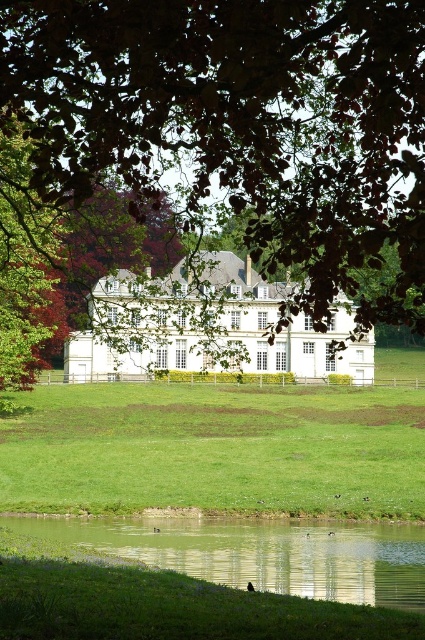
Does green leafy tree at center have a lesser width compared to green grassy at lower center?

No, green leafy tree at center is not thinner than green grassy at lower center.

Who is more distant from viewer, (x=407, y=99) or (x=23, y=580)?

Positioned behind is point (x=23, y=580).

Is point (382, 161) positioned after point (68, 564)?

That is False.

Identify the location of green leafy tree at center. (243, 124).

Can you confirm if green grassy field at lower center is bigger than green reflective water at lower center?

Yes, green grassy field at lower center is bigger than green reflective water at lower center.

Can you confirm if green grassy field at lower center is positioned to the left of green reflective water at lower center?

No, green grassy field at lower center is not to the left of green reflective water at lower center.

You are a GUI agent. You are given a task and a screenshot of the screen. Output one action in this format:
    pyautogui.click(x=<x>, y=<y>)
    Task: Click on the green grassy field at lower center
    The image size is (425, 640).
    Given the screenshot: What is the action you would take?
    pyautogui.click(x=215, y=449)

Consider the image. Which is above, green reflective water at lower center or green grassy at lower center?

Positioned higher is green reflective water at lower center.

Can you confirm if green reflective water at lower center is positioned below green grassy at lower center?

No, green reflective water at lower center is not below green grassy at lower center.

This screenshot has height=640, width=425. Find the location of `green reflective water at lower center`. green reflective water at lower center is located at coordinates (258, 552).